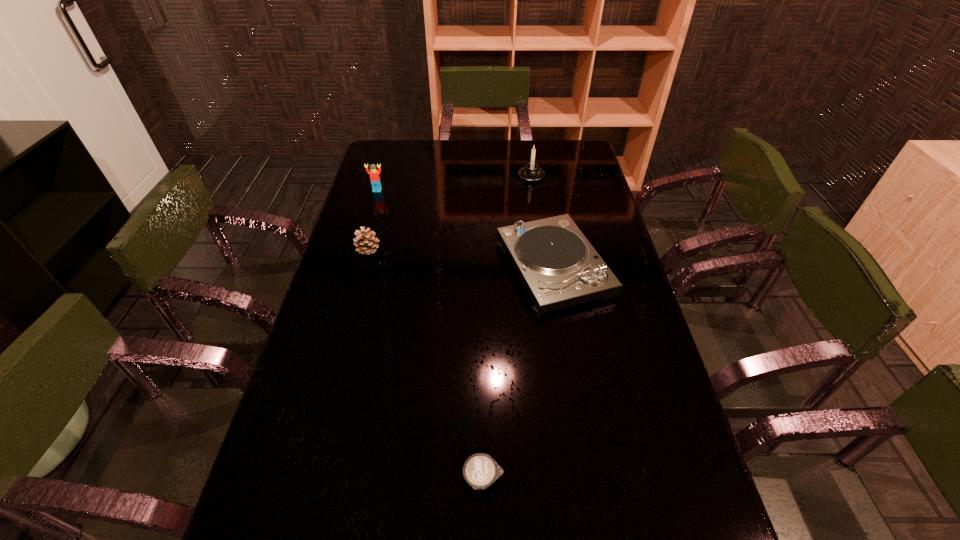
Identify the location of the closest object relative to the candle holder. (557, 265).

I want to click on object that is the third closest to the record player, so click(480, 470).

Locate an element on the screen. This screenshot has width=960, height=540. free space in the image that satisfies the following two spatial constraints: 1. on the face of the Lego; 2. on the left side of the shortest object is located at coordinates (294, 478).

Where is `vacant space that satisfies the following two spatial constraints: 1. on the face of the third object from left to right; 2. on the right side of the Lego`? Image resolution: width=960 pixels, height=540 pixels. vacant space that satisfies the following two spatial constraints: 1. on the face of the third object from left to right; 2. on the right side of the Lego is located at coordinates (294, 478).

You are a GUI agent. You are given a task and a screenshot of the screen. Output one action in this format:
    pyautogui.click(x=<x>, y=<y>)
    Task: Click on the vacant space that satisfies the following two spatial constraints: 1. on the front side of the nearest object; 2. on the right side of the pinecone
    The width and height of the screenshot is (960, 540).
    Given the screenshot: What is the action you would take?
    pyautogui.click(x=306, y=478)

This screenshot has width=960, height=540. Find the location of `blank area in the image that satisfies the following two spatial constraints: 1. on the face of the shortest object; 2. on the right side of the Lego`. blank area in the image that satisfies the following two spatial constraints: 1. on the face of the shortest object; 2. on the right side of the Lego is located at coordinates (294, 478).

This screenshot has height=540, width=960. I want to click on vacant space that satisfies the following two spatial constraints: 1. on the front side of the record player; 2. on the left side of the pinecone, so click(363, 268).

Where is `blank space that satisfies the following two spatial constraints: 1. with a handle on the side of the farthest object; 2. on the right side of the record player`? blank space that satisfies the following two spatial constraints: 1. with a handle on the side of the farthest object; 2. on the right side of the record player is located at coordinates (545, 268).

This screenshot has width=960, height=540. I want to click on free space that satisfies the following two spatial constraints: 1. with a handle on the side of the record player; 2. on the right side of the farthest object, so click(545, 268).